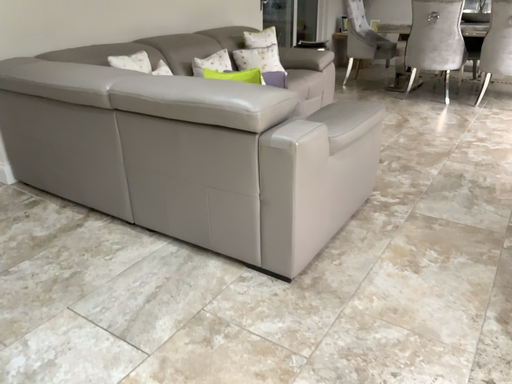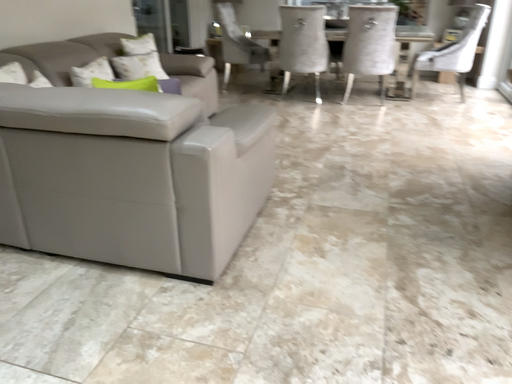
Question: Which way did the camera rotate in the video?

Choices:
 (A) rotated left
 (B) rotated right

Answer: (B)